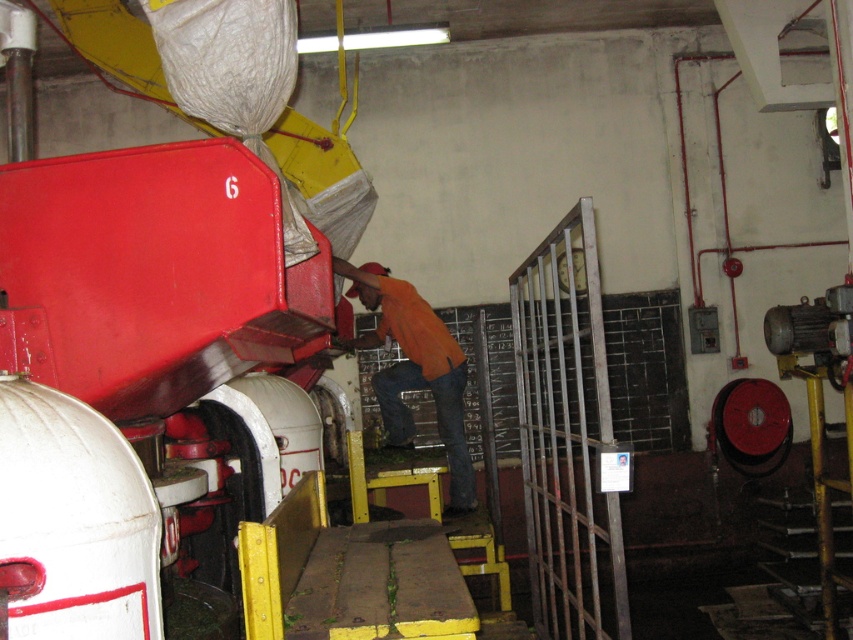
Measure the distance between point (543,269) and camera.

4.04 meters

You are a GUI agent. You are given a task and a screenshot of the screen. Output one action in this format:
    pyautogui.click(x=<x>, y=<y>)
    Task: Click on the metallic gate at right
    This screenshot has width=853, height=640.
    Given the screenshot: What is the action you would take?
    pyautogui.click(x=566, y=435)

The width and height of the screenshot is (853, 640). I want to click on metallic gate at right, so click(x=566, y=435).

The image size is (853, 640). In order to click on metallic gate at right in this screenshot , I will do `click(566, 435)`.